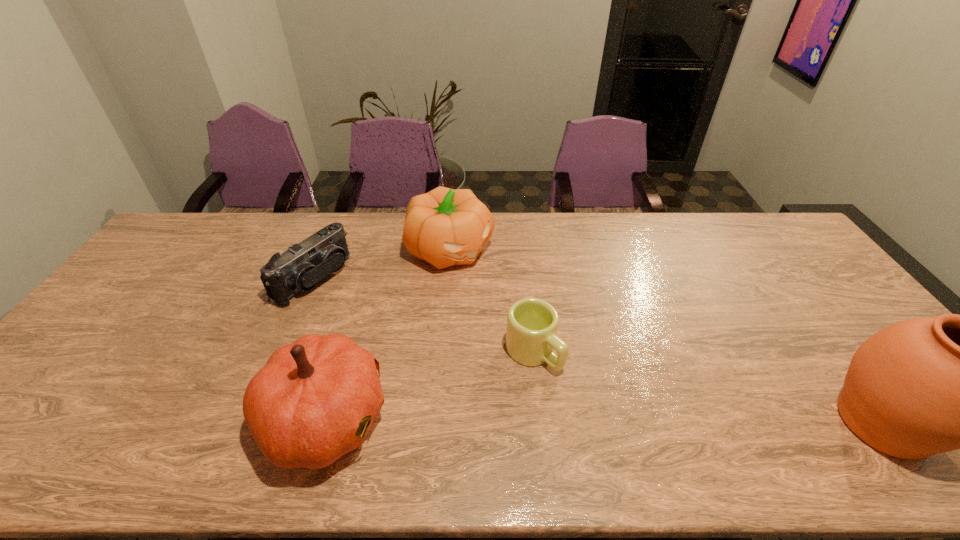
At what (x,y) coordinates should I click in order to perform the action: click on vacant space at the right edge. Please return your answer as a coordinate pair (x, y). This screenshot has height=540, width=960. Looking at the image, I should click on (799, 260).

This screenshot has height=540, width=960. I want to click on vacant space at the far left corner, so click(x=176, y=230).

Find the location of a particular element. The image size is (960, 540). vacant space at the near left corner of the desktop is located at coordinates (32, 407).

Where is `free spot at the far right corner of the desktop`? The width and height of the screenshot is (960, 540). free spot at the far right corner of the desktop is located at coordinates (742, 212).

The height and width of the screenshot is (540, 960). In order to click on free space between the fourth object from left to right and the camcorder in this screenshot , I will do `click(423, 315)`.

You are a GUI agent. You are given a task and a screenshot of the screen. Output one action in this format:
    pyautogui.click(x=<x>, y=<y>)
    Task: Click on the vacant area that lies between the shorter pumpkin and the nearer pumpkin
    This screenshot has height=540, width=960.
    Given the screenshot: What is the action you would take?
    pyautogui.click(x=388, y=334)

Find the location of `vacant area that lies between the second object from right to left and the nearer pumpkin`. vacant area that lies between the second object from right to left and the nearer pumpkin is located at coordinates (430, 386).

Identify the location of empty space between the mug and the third tallest object. (492, 301).

Find the location of a particular element. This screenshot has width=960, height=540. unoccupied area between the third tallest object and the nearer pumpkin is located at coordinates (388, 334).

Find the location of a particular element. free spot between the farther pumpkin and the mug is located at coordinates (492, 301).